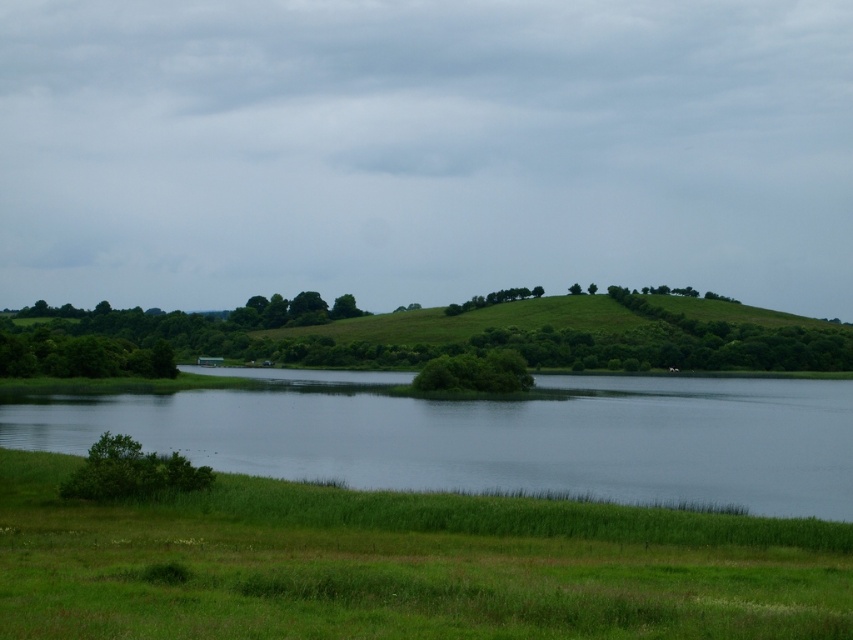
Can you confirm if green leafy trees at center is taller than green leafy bush at lower left?

Yes.

Identify the location of green leafy trees at center. The height and width of the screenshot is (640, 853). (413, 337).

Does green grassy water at lower left appear over green leafy bush at lower left?

No, green grassy water at lower left is not above green leafy bush at lower left.

Between point (206, 456) and point (115, 465), which one is positioned behind?

The point (206, 456) is more distant.

Locate an element on the screen. green grassy water at lower left is located at coordinates (494, 435).

Is green grassy at lower center above green leafy bush at lower left?

No, green grassy at lower center is not above green leafy bush at lower left.

Does point (811, 554) come closer to viewer compared to point (123, 440)?

Yes, it is in front of point (123, 440).

Locate an element on the screen. This screenshot has width=853, height=640. green grassy at lower center is located at coordinates (402, 564).